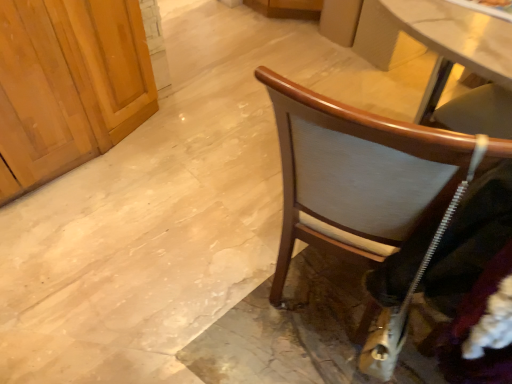
Question: From the image's perspective, is wooden chair at right above or below velvet black jacket at right?

Choices:
 (A) below
 (B) above

Answer: (B)

Question: Considering the relative positions of wooden chair at right and velvet black jacket at right in the image provided, is wooden chair at right to the left or to the right of velvet black jacket at right?

Choices:
 (A) left
 (B) right

Answer: (A)

Question: From their relative heights in the image, would you say wooden chair at right is taller or shorter than velvet black jacket at right?

Choices:
 (A) tall
 (B) short

Answer: (B)

Question: Based on their sizes in the image, would you say velvet black jacket at right is bigger or smaller than wooden chair at right?

Choices:
 (A) big
 (B) small

Answer: (B)

Question: From the image's perspective, relative to wooden chair at right, is velvet black jacket at right above or below?

Choices:
 (A) above
 (B) below

Answer: (B)

Question: In terms of width, does velvet black jacket at right look wider or thinner when compared to wooden chair at right?

Choices:
 (A) thin
 (B) wide

Answer: (B)

Question: Is point (480, 236) closer or farther from the camera than point (486, 157)?

Choices:
 (A) closer
 (B) farther

Answer: (B)